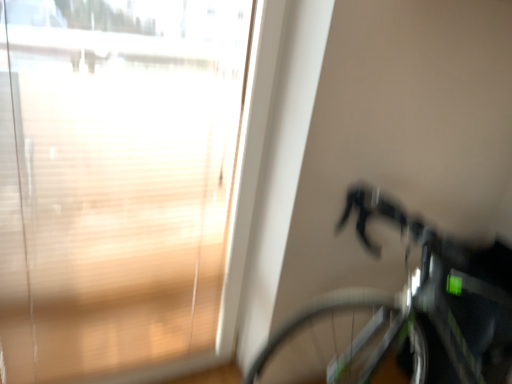
Question: Considering the positions of shiny black bicycle at right and transparent glass window at upper left in the image, is shiny black bicycle at right taller or shorter than transparent glass window at upper left?

Choices:
 (A) tall
 (B) short

Answer: (B)

Question: Is shiny black bicycle at right in front of or behind transparent glass window at upper left in the image?

Choices:
 (A) front
 (B) behind

Answer: (A)

Question: From a real-world perspective, is shiny black bicycle at right positioned above or below transparent glass window at upper left?

Choices:
 (A) above
 (B) below

Answer: (B)

Question: In the image, is transparent glass window at upper left positioned in front of or behind shiny black bicycle at right?

Choices:
 (A) front
 (B) behind

Answer: (B)

Question: Is transparent glass window at upper left to the left or to the right of shiny black bicycle at right in the image?

Choices:
 (A) left
 (B) right

Answer: (A)

Question: Is transparent glass window at upper left taller or shorter than shiny black bicycle at right?

Choices:
 (A) short
 (B) tall

Answer: (B)

Question: In terms of size, does transparent glass window at upper left appear bigger or smaller than shiny black bicycle at right?

Choices:
 (A) small
 (B) big

Answer: (A)